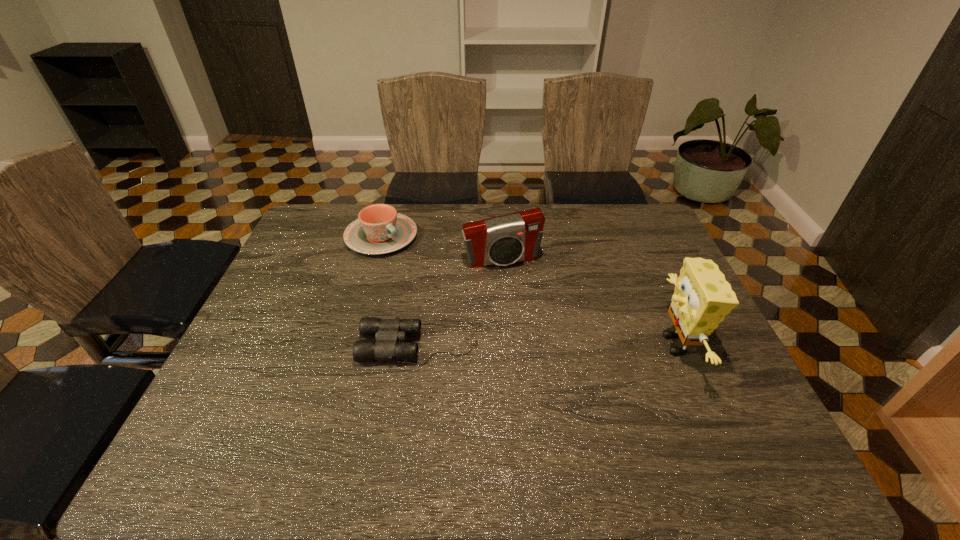
Image resolution: width=960 pixels, height=540 pixels. Identify the location of object that is the second closest to the shortest object. (379, 229).

This screenshot has width=960, height=540. Identify the location of free space that satisfies the following two spatial constraints: 1. on the front side of the binoculars; 2. at the eyepiece of the chinaware. (350, 344).

Find the location of `vacant point that satisfies the following two spatial constraints: 1. on the front side of the third tallest object; 2. on the left side of the third shortest object`. vacant point that satisfies the following two spatial constraints: 1. on the front side of the third tallest object; 2. on the left side of the third shortest object is located at coordinates (375, 260).

You are a GUI agent. You are given a task and a screenshot of the screen. Output one action in this format:
    pyautogui.click(x=<x>, y=<y>)
    Task: Click on the vacant space that satisfies the following two spatial constraints: 1. on the front side of the third shortest object; 2. on the left side of the second shortest object
    
    Given the screenshot: What is the action you would take?
    pyautogui.click(x=375, y=260)